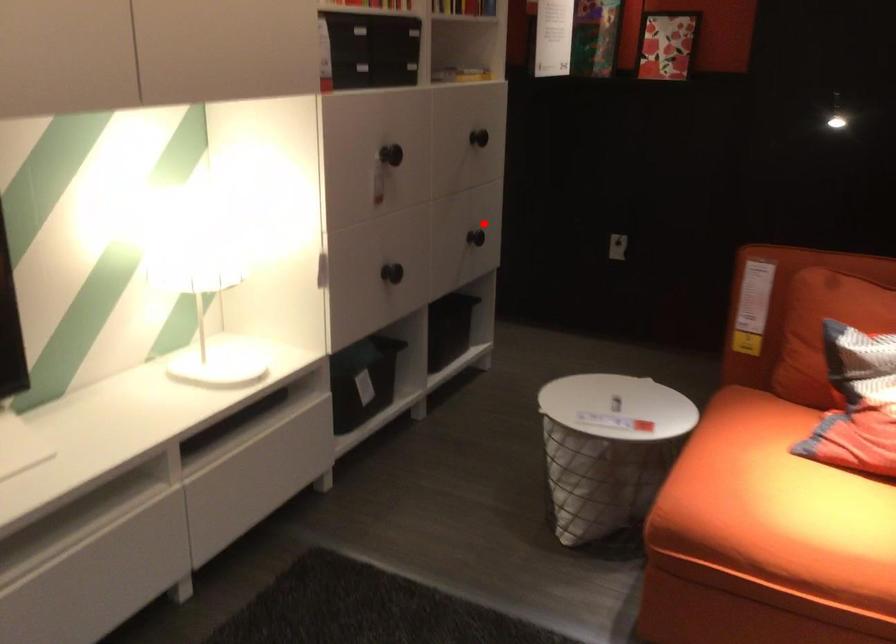
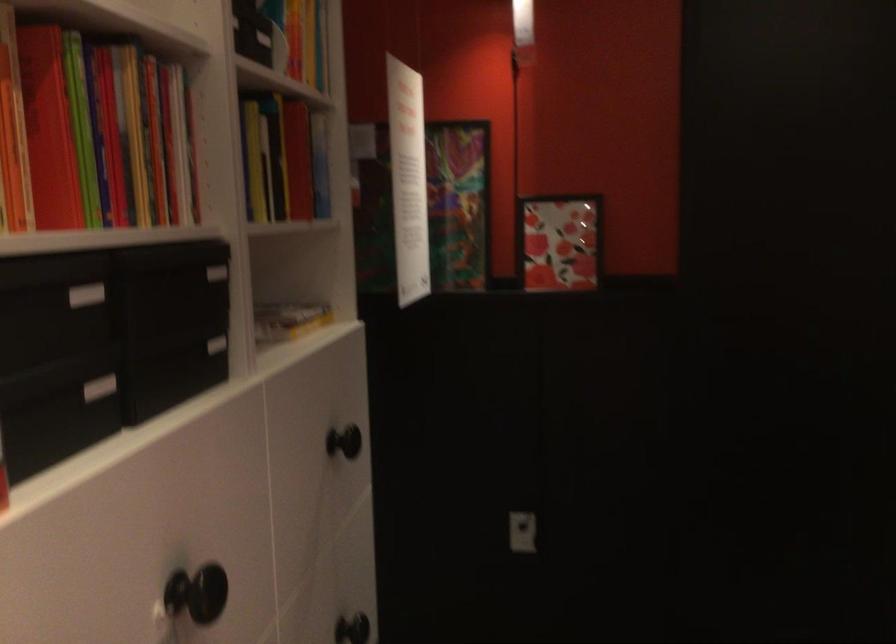
Question: I am providing you with two images of the same scene from different viewpoints. In image1, a red point is highlighted. Considering the same 3D point in image2, which of the following is correct?

Choices:
 (A) It is closer
 (B) It is farther

Answer: (A)